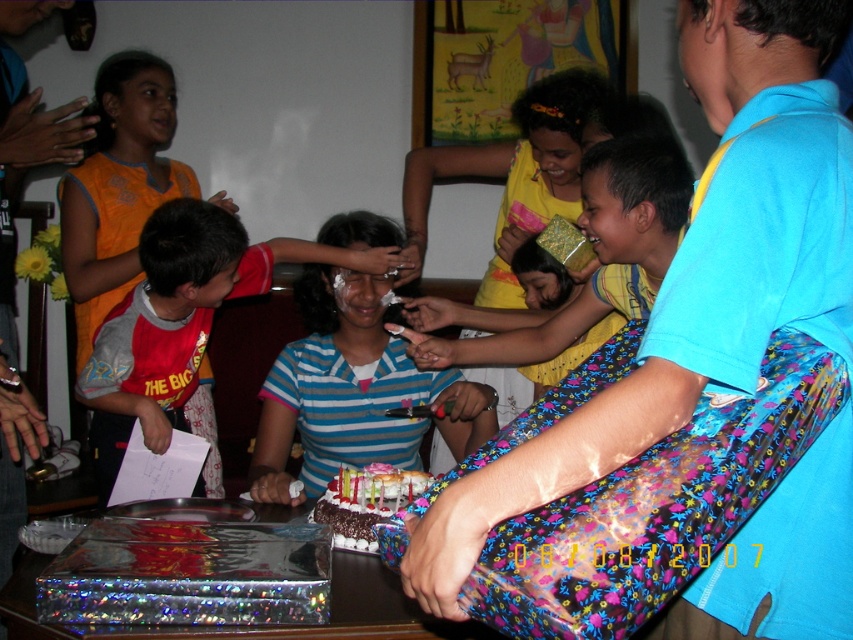
Question: Is blue striped shirt at center to the right of chocolate frosted cake at center from the viewer's perspective?

Choices:
 (A) yes
 (B) no

Answer: (B)

Question: Which object appears closest to the camera in this image?

Choices:
 (A) striped cotton shirt at center
 (B) chocolate frosted cake at center
 (C) blue striped shirt at center

Answer: (B)

Question: Does striped cotton shirt at center come behind shiny metallic table at center?

Choices:
 (A) no
 (B) yes

Answer: (B)

Question: Is striped cotton shirt at center above chocolate frosted cake at center?

Choices:
 (A) no
 (B) yes

Answer: (B)

Question: Which of these objects is positioned closest to the blue striped shirt at center?

Choices:
 (A) striped cotton shirt at center
 (B) chocolate frosted cake at center
 (C) shiny metallic table at center

Answer: (A)

Question: Which point is closer to the camera taking this photo?

Choices:
 (A) (165, 250)
 (B) (445, 380)
 (C) (379, 515)

Answer: (C)